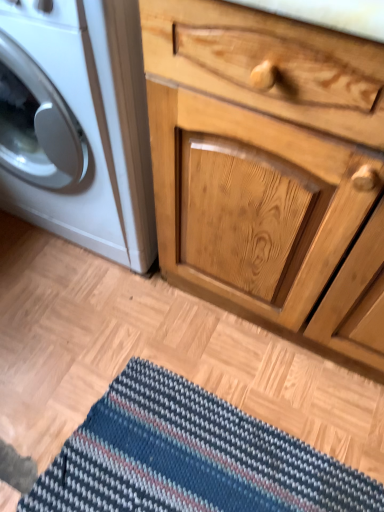
What is the approximate height of white glossy washing machine at left?

It is 26.37 inches.

Measure the distance between point (90,190) and camera.

The depth of point (90,190) is 97.60 centimeters.

What do you see at coordinates (189, 458) in the screenshot?
I see `striped fabric doormat at lower center` at bounding box center [189, 458].

You are a GUI agent. You are given a task and a screenshot of the screen. Output one action in this format:
    pyautogui.click(x=<x>, y=<y>)
    Task: Click on the natural wood cabinet at center
    The height and width of the screenshot is (512, 384).
    Given the screenshot: What is the action you would take?
    pyautogui.click(x=267, y=163)

What are the coordinates of `white glossy washing machine at left` in the screenshot? It's located at (77, 124).

How far apart are natural wood cabinet at center and striped fabric doormat at lower center?

They are 19.23 inches apart.

Consider the image. What's the angular difference between natural wood cabinet at center and striped fabric doormat at lower center's facing directions?

They differ by 0.634 degrees in their facing directions.

Is natural wood cabinet at center positioned far away from striped fabric doormat at lower center?

That's not correct — natural wood cabinet at center is a little close to striped fabric doormat at lower center.

Considering the points (191, 135) and (327, 456), which point is in front, point (191, 135) or point (327, 456)?

The point (191, 135) is in front.

Is point (264, 112) closer or farther from the camera than point (113, 233)?

Point (264, 112) is closer to the camera than point (113, 233).

Measure the distance between natural wood cabinet at center and white glossy washing machine at left.

The distance of natural wood cabinet at center from white glossy washing machine at left is 9.59 inches.

Is natural wood cabinet at center taller or shorter than white glossy washing machine at left?

In the image, natural wood cabinet at center appears to be taller than white glossy washing machine at left.

Who is smaller, natural wood cabinet at center or white glossy washing machine at left?

white glossy washing machine at left is smaller.

Does point (150, 426) lie behind point (120, 188)?

Yes, point (150, 426) is behind point (120, 188).

Considering the relative positions of striped fabric doormat at lower center and white glossy washing machine at left in the image provided, is striped fabric doormat at lower center to the left or to the right of white glossy washing machine at left?

striped fabric doormat at lower center is positioned on white glossy washing machine at left's right side.

Which object is wider, striped fabric doormat at lower center or white glossy washing machine at left?

white glossy washing machine at left is wider.

Is striped fabric doormat at lower center smaller than white glossy washing machine at left?

Correct, striped fabric doormat at lower center occupies less space than white glossy washing machine at left.

Is point (150, 388) more distant than point (213, 188)?

Yes, point (150, 388) is behind point (213, 188).

Is natural wood cabinet at center a part of striped fabric doormat at lower center?

No, striped fabric doormat at lower center does not contain natural wood cabinet at center.

From the image's perspective, which object appears higher, striped fabric doormat at lower center or natural wood cabinet at center?

natural wood cabinet at center is shown above in the image.

This screenshot has height=512, width=384. What are the coordinates of `chest of drawers located on the right of striped fabric doormat at lower center` in the screenshot? It's located at (267, 163).

Measure the distance from white glossy washing machine at left to natural wood cabinet at center.

9.59 inches.

Is point (141, 82) farther from viewer compared to point (334, 347)?

No, (141, 82) is in front of (334, 347).

Which is more to the left, white glossy washing machine at left or natural wood cabinet at center?

white glossy washing machine at left.

From the image's perspective, between white glossy washing machine at left and natural wood cabinet at center, who is located below?

natural wood cabinet at center appears lower in the image.

Are white glossy washing machine at left and striped fabric doormat at lower center far apart?

That's not correct — white glossy washing machine at left is a little close to striped fabric doormat at lower center.

Is white glossy washing machine at left smaller than striped fabric doormat at lower center?

No.

Do you think white glossy washing machine at left is within striped fabric doormat at lower center, or outside of it?

white glossy washing machine at left exists outside the volume of striped fabric doormat at lower center.

Is white glossy washing machine at left aimed at striped fabric doormat at lower center?

Yes, white glossy washing machine at left is aimed at striped fabric doormat at lower center.

Image resolution: width=384 pixels, height=512 pixels. There is a striped fabric doormat at lower center. Identify the location of the chest of drawers above it (from a real-world perspective). (267, 163).

You are a GUI agent. You are given a task and a screenshot of the screen. Output one action in this format:
    pyautogui.click(x=<x>, y=<y>)
    Task: Click on the washing machine lying above the natural wood cabinet at center (from the image's perspective)
    
    Given the screenshot: What is the action you would take?
    pyautogui.click(x=77, y=124)

Based on their spatial positions, is white glossy washing machine at left or natural wood cabinet at center closer to striped fabric doormat at lower center?

Based on the image, natural wood cabinet at center appears to be nearer to striped fabric doormat at lower center.

Considering their positions, is natural wood cabinet at center positioned closer to striped fabric doormat at lower center than white glossy washing machine at left?

natural wood cabinet at center is closer to striped fabric doormat at lower center.

From the picture: Estimate the real-world distances between objects in this image. Which object is closer to natural wood cabinet at center, striped fabric doormat at lower center or white glossy washing machine at left?

Based on the image, white glossy washing machine at left appears to be nearer to natural wood cabinet at center.

Looking at this image, looking at the image, which one is located closer to white glossy washing machine at left, natural wood cabinet at center or striped fabric doormat at lower center?

natural wood cabinet at center is closer to white glossy washing machine at left.

Looking at the image, which one is located further to white glossy washing machine at left, striped fabric doormat at lower center or natural wood cabinet at center?

striped fabric doormat at lower center is further to white glossy washing machine at left.

Looking at the image, which one is located further to natural wood cabinet at center, white glossy washing machine at left or striped fabric doormat at lower center?

The object further to natural wood cabinet at center is striped fabric doormat at lower center.

In order to click on chest of drawers between white glossy washing machine at left and striped fabric doormat at lower center from top to bottom in this screenshot , I will do `click(267, 163)`.